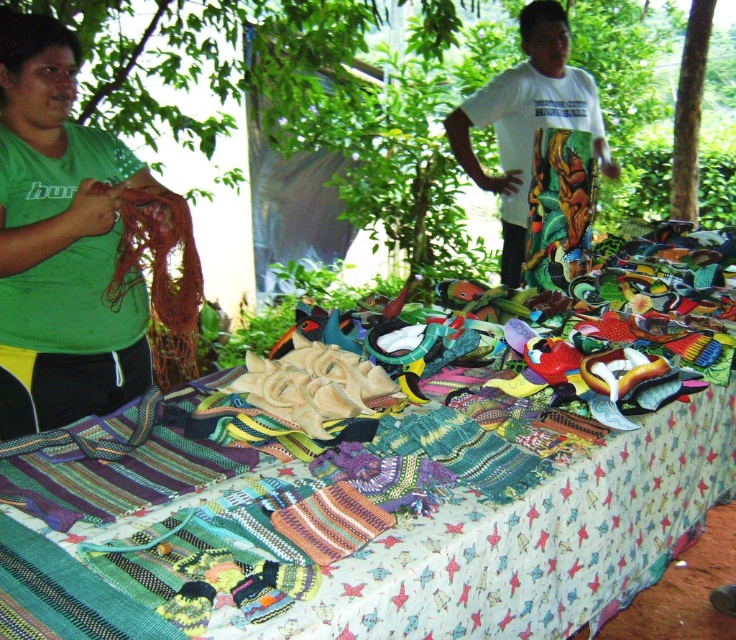
You are standing at the entrance of the market and see two points in the scene. The first point is at coordinates point (344, 545) and the second is at point (116, 232). Which point is closer to you?

Point (344, 545) is closer to the viewer than point (116, 232).

In the scene shown: You are a customer at the market and want to buy both the textile bags at center and the green matte shirt at left. The vendor says you can only carry one item in each hand. Which item should you hold in your right hand if you want to balance the weight better?

The textile bags at center is larger in size than green matte shirt at left, so it might be heavier. To balance the weight better, you should hold the larger, heavier textile bags at center in your right hand and the lighter green matte shirt at left in your left hand.